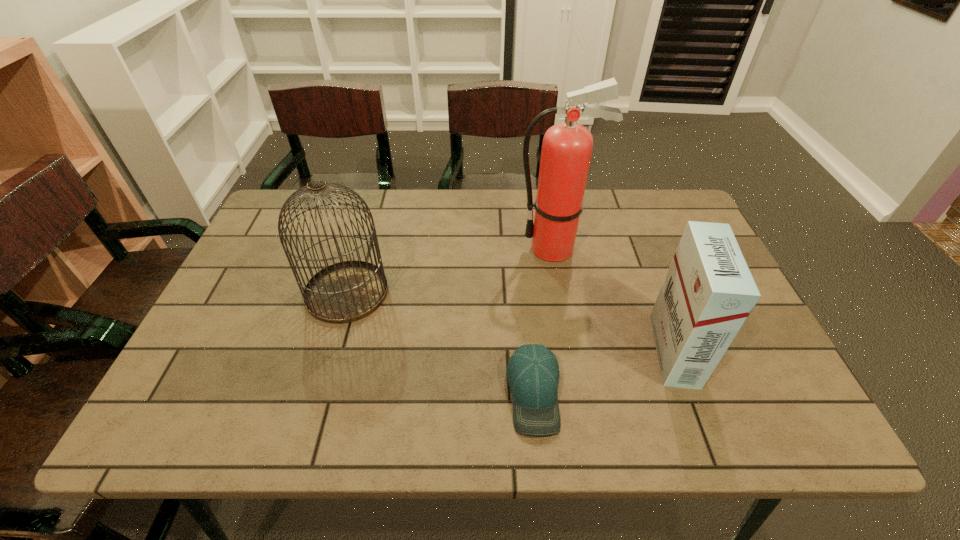
Locate an element on the screen. The width and height of the screenshot is (960, 540). free space located on the right of the baseball cap is located at coordinates (665, 393).

Where is `object at the far edge`? Image resolution: width=960 pixels, height=540 pixels. object at the far edge is located at coordinates (567, 147).

Where is `object located in the near edge section of the desktop`? object located in the near edge section of the desktop is located at coordinates (533, 372).

Image resolution: width=960 pixels, height=540 pixels. What are the coordinates of `object that is positioned at the right edge` in the screenshot? It's located at (708, 293).

Find the location of `free region at the far edge`. free region at the far edge is located at coordinates (526, 212).

In the image, there is a desktop. At what (x,y) coordinates should I click in order to perform the action: click on vacant space at the near edge. Please return your answer as a coordinate pair (x, y). Looking at the image, I should click on (336, 417).

Where is `vacant space at the left edge of the desktop`? This screenshot has width=960, height=540. vacant space at the left edge of the desktop is located at coordinates (241, 359).

The image size is (960, 540). In order to click on vacant region at the far left corner of the desktop in this screenshot , I will do `click(313, 222)`.

This screenshot has height=540, width=960. I want to click on free space at the far right corner of the desktop, so click(674, 196).

Identify the location of vacant area that lies between the fire extinguisher and the baseball cap. The image size is (960, 540). click(544, 321).